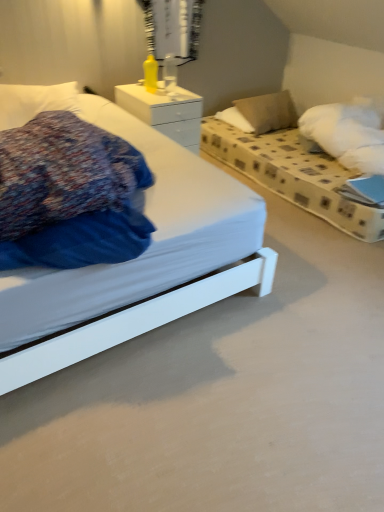
Describe the element at coordinates (165, 112) in the screenshot. This screenshot has width=384, height=512. I see `white glossy nightstand at upper center` at that location.

Identify the location of white glossy nightstand at upper center. This screenshot has height=512, width=384. (165, 112).

Where is `white glossy nightstand at upper center`? The width and height of the screenshot is (384, 512). white glossy nightstand at upper center is located at coordinates (165, 112).